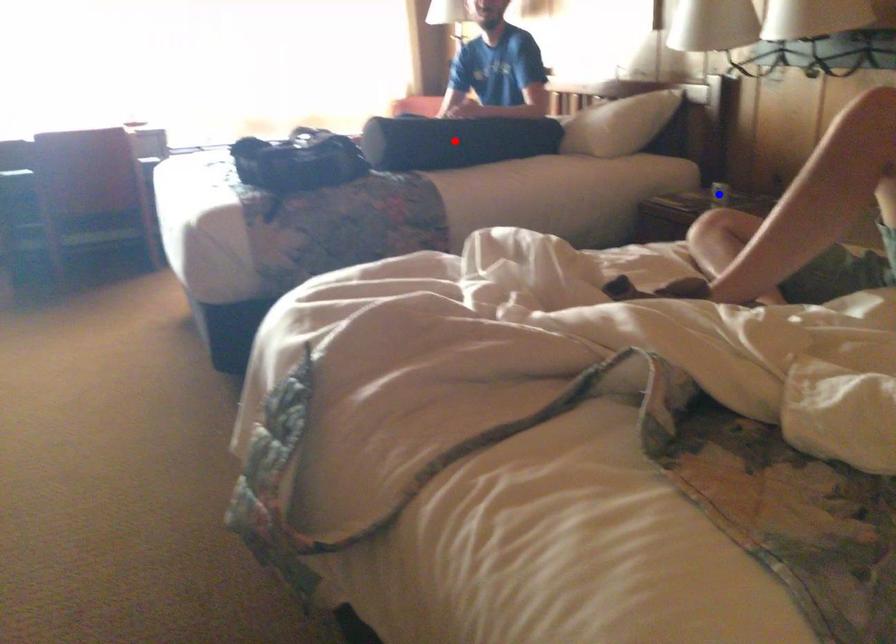
Question: Which of the two points in the image is closer to the camera?

Choices:
 (A) Blue point is closer.
 (B) Red point is closer.

Answer: (A)